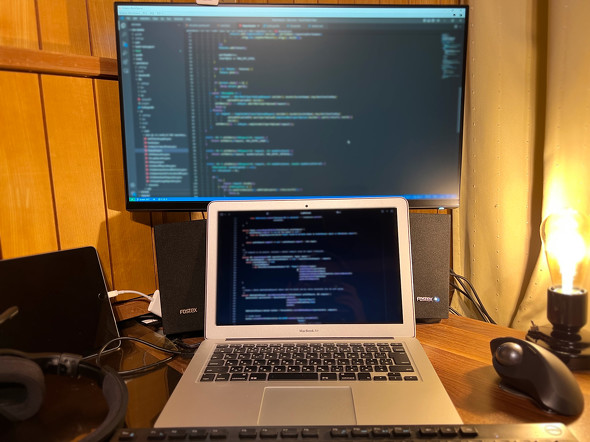
You are a GUI agent. You are given a task and a screenshot of the screen. Output one action in this format:
    pyautogui.click(x=<x>, y=<y>)
    Task: Click on the keyboards
    
    Given the screenshot: What is the action you would take?
    pyautogui.click(x=317, y=365), pyautogui.click(x=425, y=435)